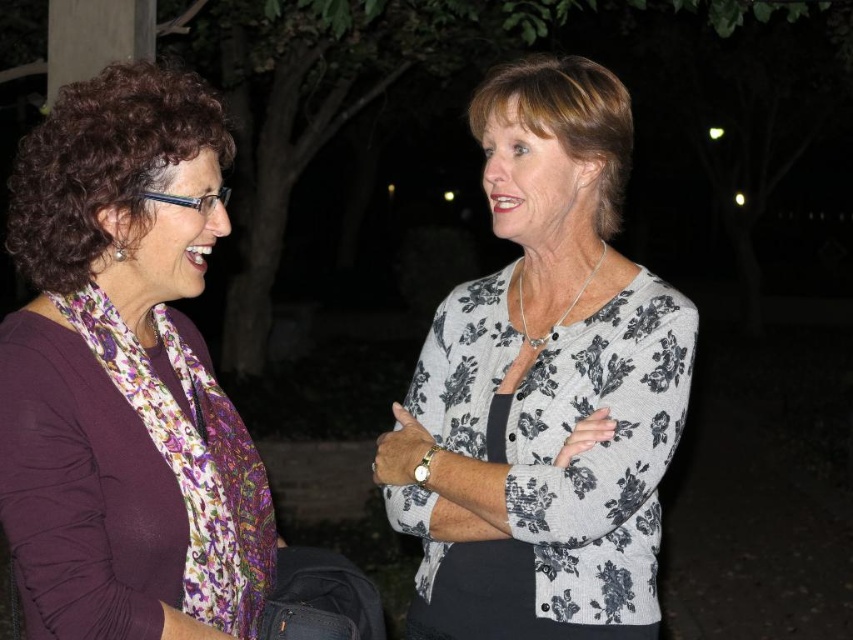
Question: Is purple matte scarf at left smaller than floral-patterned cardigan at center?

Choices:
 (A) no
 (B) yes

Answer: (A)

Question: Among these points, which one is farthest from the camera?

Choices:
 (A) (229, 563)
 (B) (570, 353)

Answer: (B)

Question: Observing the image, what is the correct spatial positioning of purple matte scarf at left in reference to floral-patterned cardigan at center?

Choices:
 (A) left
 (B) right

Answer: (A)

Question: Can you confirm if purple matte scarf at left is bigger than floral-patterned cardigan at center?

Choices:
 (A) no
 (B) yes

Answer: (B)